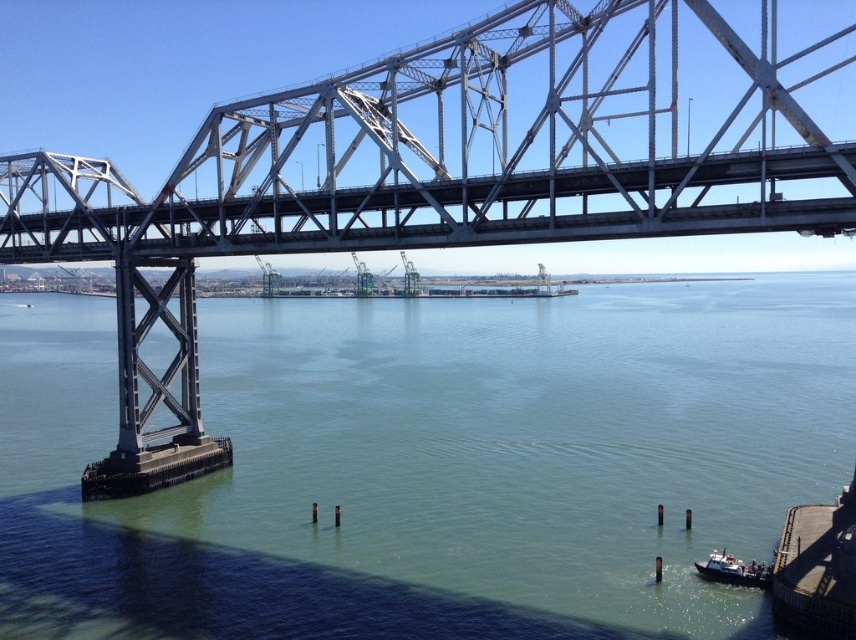
You are standing on the smooth concrete dock at lower right and want to reach the green water at lower center. Is the water above or below your current position?

The green water at lower center is above the smooth concrete dock at lower right, so the water is higher than your current position on the dock.

You are a photographer positioned at the base of the bridge, aiming to capture both point (x=745, y=628) and point (x=750, y=570) in your shot. Which point will appear larger in your photo?

Point (x=745, y=628) is closer to the camera than point (x=750, y=570), so it will appear larger in the photo.

You are standing on the smooth concrete dock at lower right and want to board the white plastic boat at lower right. Is the dock large enough to accommodate the boat if you want to pull it ashore?

The smooth concrete dock at lower right is bigger than the white plastic boat at lower right, so yes, the dock is large enough to accommodate the boat when pulling it ashore.